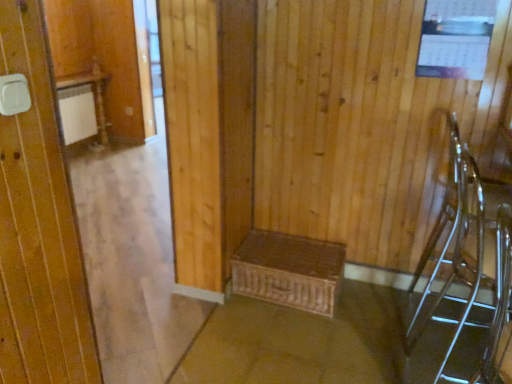
Question: In the image, is brown woven basket at lower center positioned in front of or behind clear plastic chair at right, which is the 1th armchair in front-to-back order?

Choices:
 (A) behind
 (B) front

Answer: (A)

Question: Is brown woven basket at lower center spatially inside clear plastic chair at right, which appears as the 2th armchair when viewed from the back, or outside of it?

Choices:
 (A) inside
 (B) outside

Answer: (B)

Question: Which of these objects is positioned closest to the clear glass armchair at right, which appears as the first armchair when viewed from the back?

Choices:
 (A) woven brown chest at center
 (B) brown woven basket at lower center
 (C) clear plastic chair at right, which is the 1th armchair in front-to-back order

Answer: (C)

Question: Estimate the real-world distances between objects in this image. Which object is closer to the clear plastic chair at right, which is the 1th armchair in front-to-back order?

Choices:
 (A) woven brown chest at center
 (B) clear glass armchair at right, the 2th armchair positioned from the front
 (C) brown woven basket at lower center

Answer: (B)